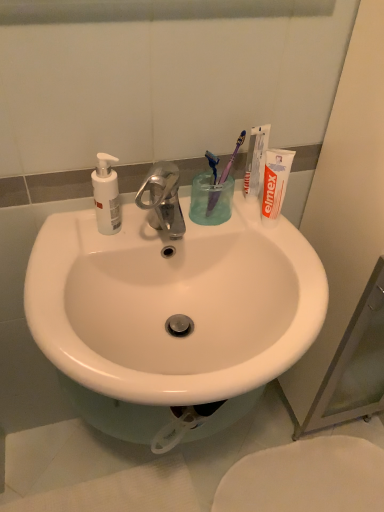
Locate an element on the screen. This screenshot has height=512, width=384. vacant area that is in front of white matte soap dispenser at left is located at coordinates (69, 273).